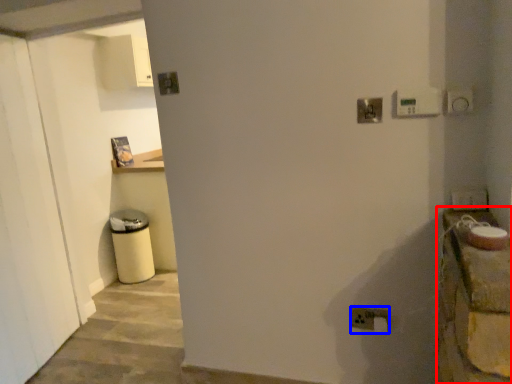
Question: Which of the following is the farthest to the observer, counter top (highlighted by a red box) or electric outlet (highlighted by a blue box)?

Choices:
 (A) counter top
 (B) electric outlet

Answer: (B)